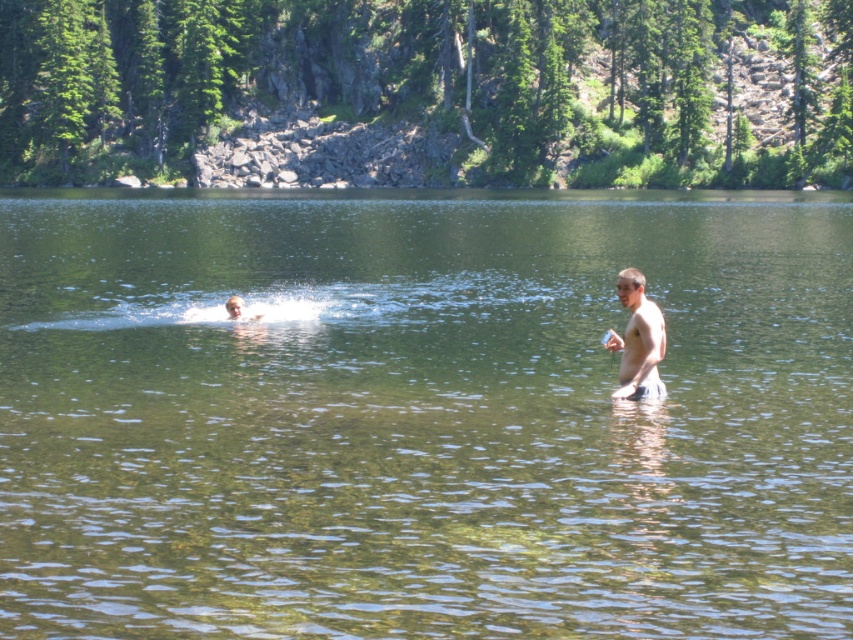
Question: Does clear water at center have a lesser width compared to skinny white man at right?

Choices:
 (A) no
 (B) yes

Answer: (A)

Question: Does clear water at center have a smaller size compared to skinny white man at right?

Choices:
 (A) no
 (B) yes

Answer: (A)

Question: Which point is closer to the camera taking this photo?

Choices:
 (A) (82, 275)
 (B) (621, 289)

Answer: (B)

Question: Can you confirm if clear water at center is positioned to the right of skinny white man at right?

Choices:
 (A) yes
 (B) no

Answer: (B)

Question: Among these objects, which one is nearest to the camera?

Choices:
 (A) skinny white man at right
 (B) clear water at center

Answer: (B)